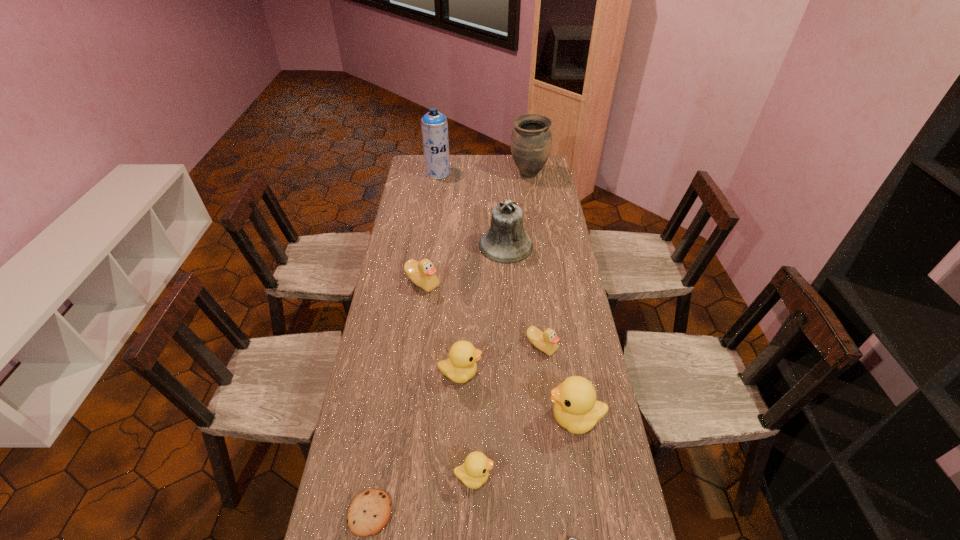
Where is `the bigger beige duck`? the bigger beige duck is located at coordinates (422, 273).

You are a GUI agent. You are given a task and a screenshot of the screen. Output one action in this format:
    pyautogui.click(x=<x>, y=<y>)
    Task: Click on the nearest duck
    The width and height of the screenshot is (960, 540).
    Given the screenshot: What is the action you would take?
    [x=474, y=472]

Locate an element on the screen. the nearest yellow duck is located at coordinates (x=474, y=472).

Image resolution: width=960 pixels, height=540 pixels. Identify the location of the nearer beige duck. (546, 341).

This screenshot has width=960, height=540. I want to click on the second farthest duck, so click(546, 341).

Identify the location of cookie. pos(369,513).

At what (x,y) coordinates should I click in order to perform the action: click on vacant region located on the front of the tallest object. Please return your answer as a coordinate pair (x, y). The image size is (960, 540). Looking at the image, I should click on (434, 202).

Identify the location of vacant position located 0.120m on the front of the second tallest object. This screenshot has height=540, width=960. (532, 198).

Where is `free space located 0.310m on the left of the eighth shortest object`? free space located 0.310m on the left of the eighth shortest object is located at coordinates (408, 246).

I want to click on vacant position located on the face of the fourth tallest object, so click(503, 418).